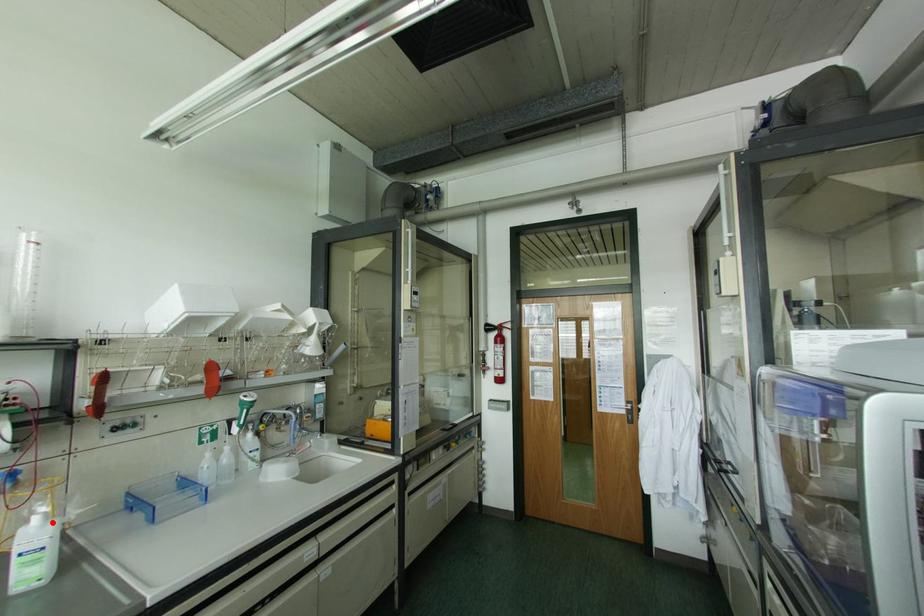
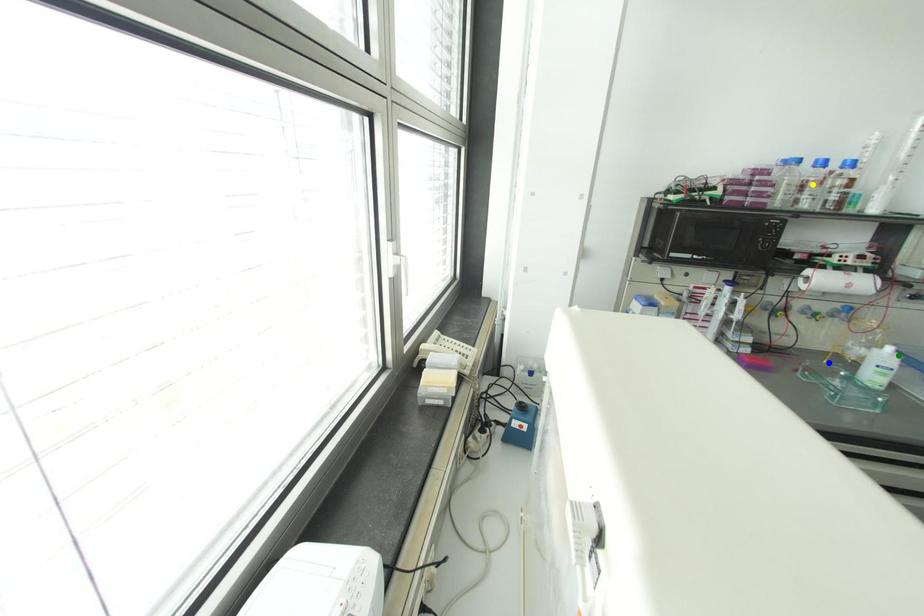
Question: I am providing you with two images of the same scene from different viewpoints. A red point is marked on the first image. You are given multiple points on the second image. Which mark in image 2 goes with the point in image 1?

Choices:
 (A) yellow point
 (B) blue point
 (C) green point

Answer: (C)